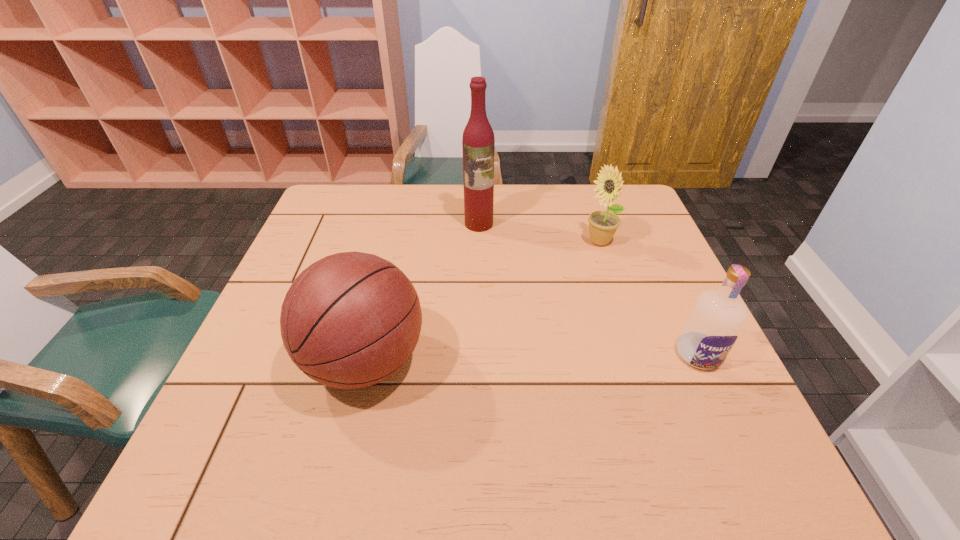
I want to click on vacant space on the desktop that is between the leftmost object and the vodka and is positioned on the face of the second farthest object, so click(x=528, y=358).

You are a GUI agent. You are given a task and a screenshot of the screen. Output one action in this format:
    pyautogui.click(x=<x>, y=<y>)
    Task: Click on the vacant spot on the desktop that is between the leftmost object and the rightmost object and is positioned on the label of the liquor
    The image size is (960, 540).
    Given the screenshot: What is the action you would take?
    pyautogui.click(x=501, y=359)